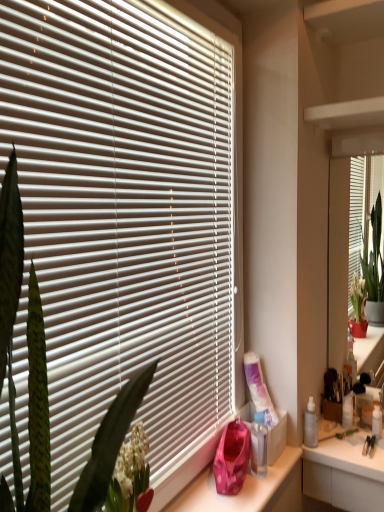
Question: Is green leafy plant at left to the left of matte white mirror at right from the viewer's perspective?

Choices:
 (A) no
 (B) yes

Answer: (B)

Question: Is green leafy plant at left not close to matte white mirror at right?

Choices:
 (A) no
 (B) yes

Answer: (B)

Question: Is green leafy plant at left next to matte white mirror at right and touching it?

Choices:
 (A) yes
 (B) no

Answer: (B)

Question: Does green leafy plant at left lie behind matte white mirror at right?

Choices:
 (A) no
 (B) yes

Answer: (A)

Question: Does green leafy plant at left appear on the right side of matte white mirror at right?

Choices:
 (A) yes
 (B) no

Answer: (B)

Question: From the image's perspective, is green leafy plant at left located above or below clear plastic bottle at lower right?

Choices:
 (A) above
 (B) below

Answer: (A)

Question: Which is correct: green leafy plant at left is inside clear plastic bottle at lower right, or outside of it?

Choices:
 (A) inside
 (B) outside

Answer: (B)

Question: Visually, is green leafy plant at left positioned to the left or to the right of clear plastic bottle at lower right?

Choices:
 (A) left
 (B) right

Answer: (A)

Question: Is point (44, 355) positioned closer to the camera than point (253, 455)?

Choices:
 (A) farther
 (B) closer

Answer: (B)

Question: In terms of size, does white plastic bottle at right, which appears as the first toiletry when viewed from the back, appear bigger or smaller than clear plastic bottle at lower right?

Choices:
 (A) big
 (B) small

Answer: (B)

Question: Does point (347, 395) appear closer or farther from the camera than point (256, 431)?

Choices:
 (A) farther
 (B) closer

Answer: (A)

Question: In terms of height, does white plastic bottle at right, the second toiletry in the front-to-back sequence, look taller or shorter compared to clear plastic bottle at lower right?

Choices:
 (A) short
 (B) tall

Answer: (A)

Question: Is white plastic bottle at right, which is the 2th toiletry from left to right, wider or thinner than clear plastic bottle at lower right?

Choices:
 (A) wide
 (B) thin

Answer: (B)

Question: Does point (31, 441) appear closer or farther from the camera than point (336, 461)?

Choices:
 (A) closer
 (B) farther

Answer: (A)

Question: From a real-world perspective, is green leafy plant at left physically located above or below white glossy counter at lower right?

Choices:
 (A) above
 (B) below

Answer: (A)